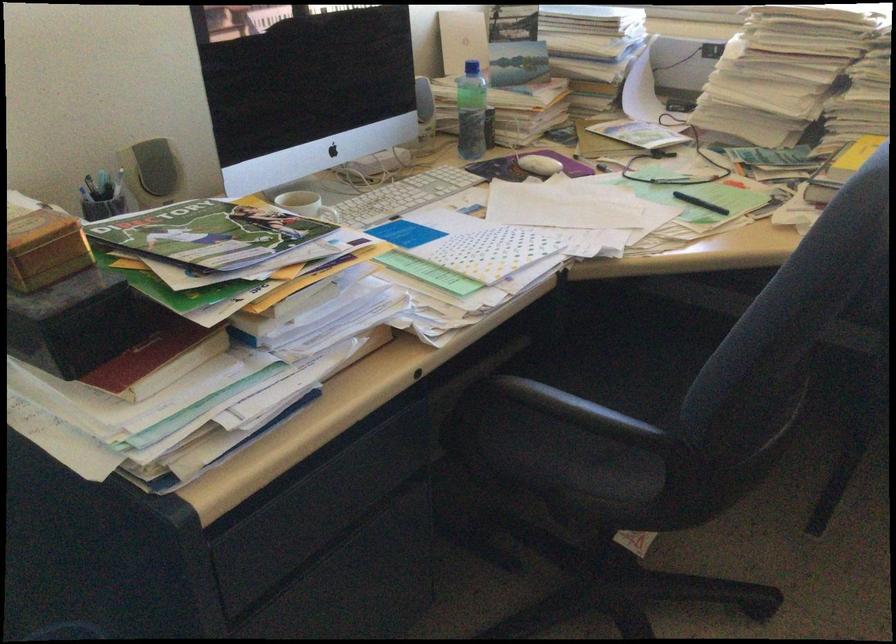
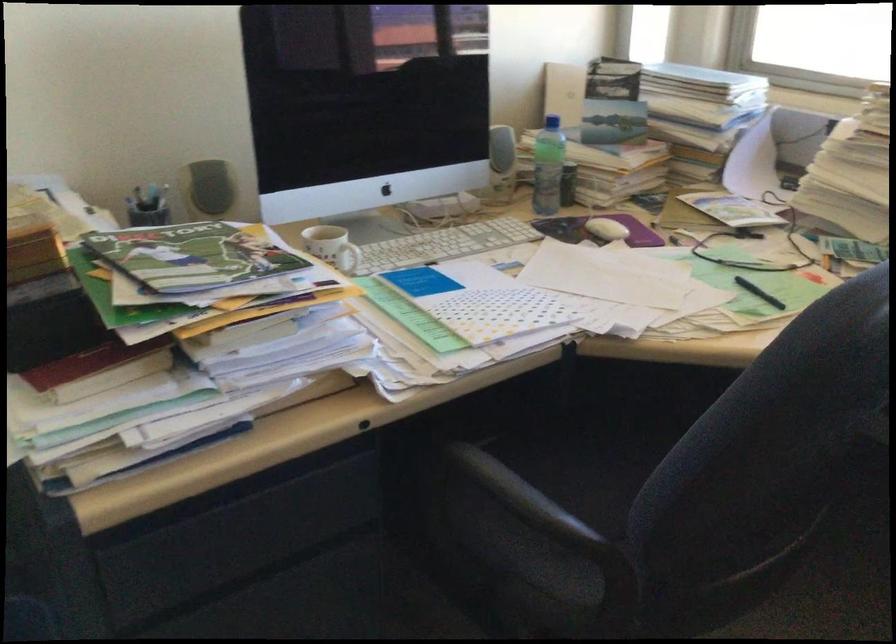
In the second image, find the point that corresponds to point 546,164 in the first image.

(606, 229)